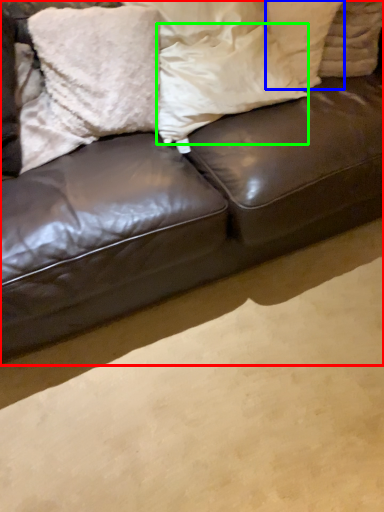
Question: Which object is positioned farthest from studio couch (highlighted by a red box)? Select from pillow (highlighted by a blue box) and pillow (highlighted by a green box).

Choices:
 (A) pillow
 (B) pillow

Answer: (A)